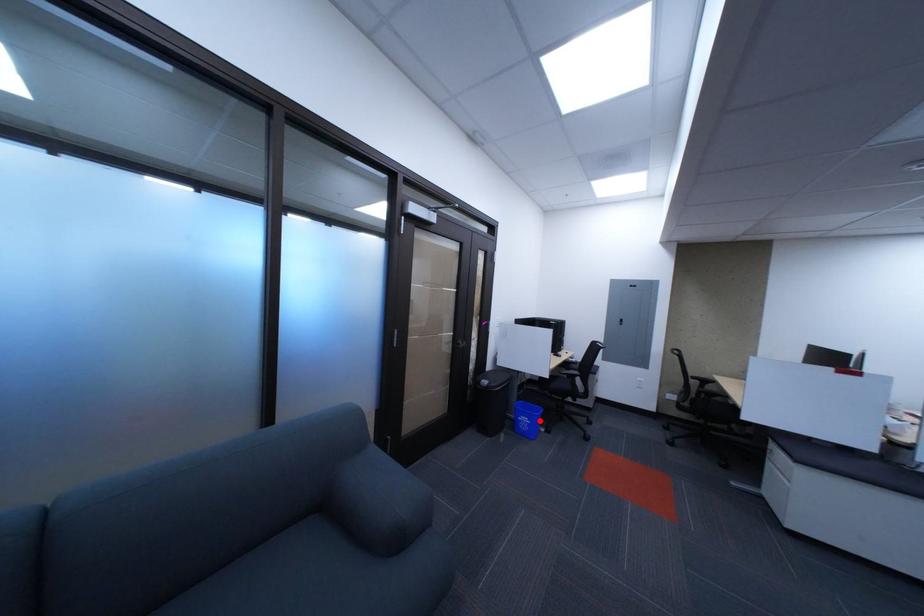
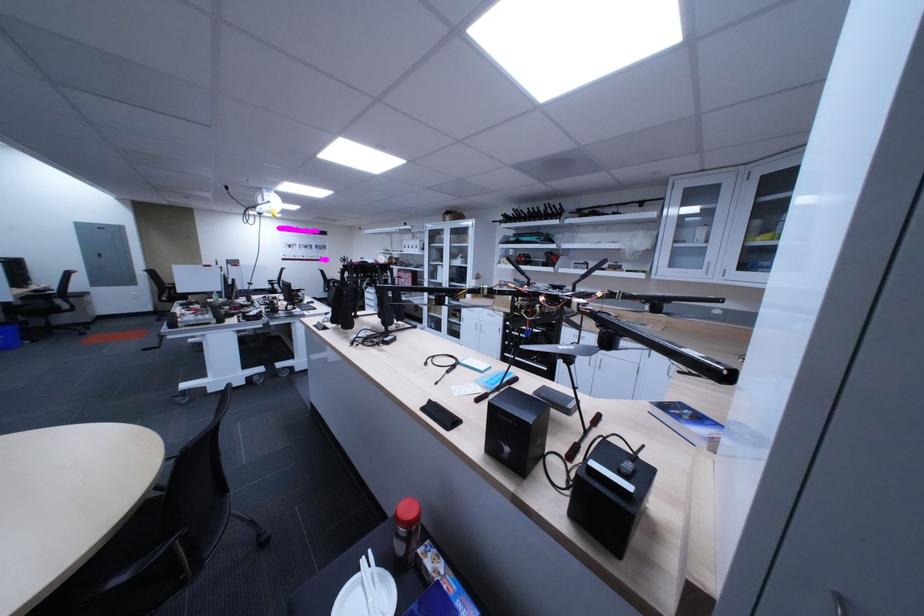
In the second image, find the point that corresponds to the highlighted location in the first image.

(9, 339)